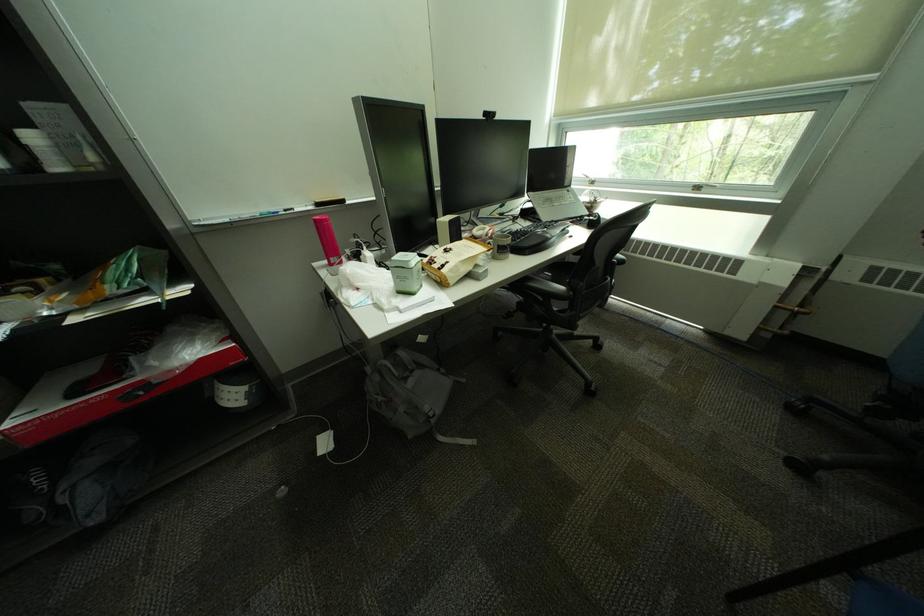
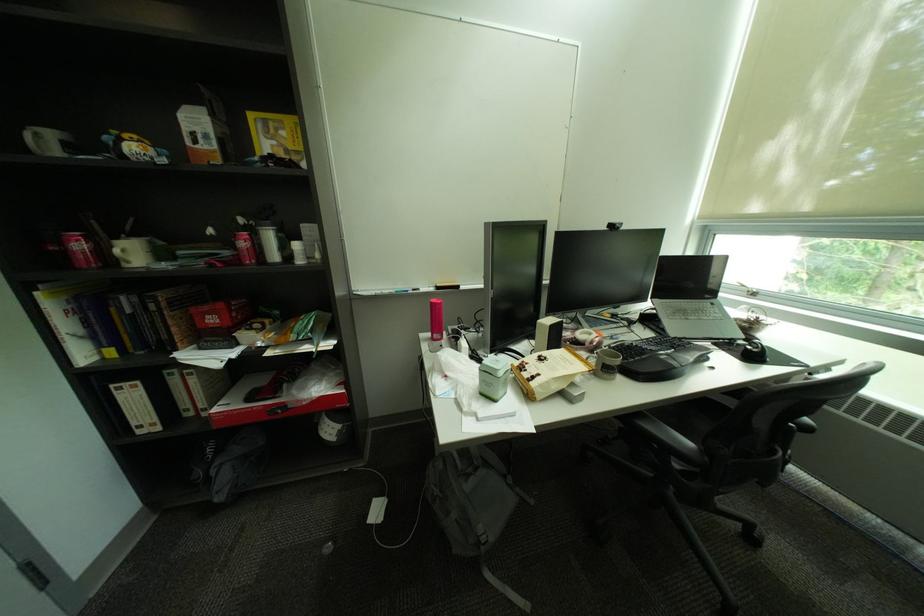
Where in the second image is the point corresponding to the point at 496,115 from the first image?

(621, 227)